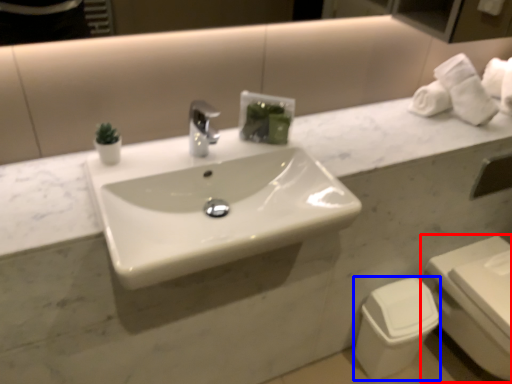
Question: Which object is further to the camera taking this photo, toilet (highlighted by a red box) or toilet bowl (highlighted by a blue box)?

Choices:
 (A) toilet
 (B) toilet bowl

Answer: (B)